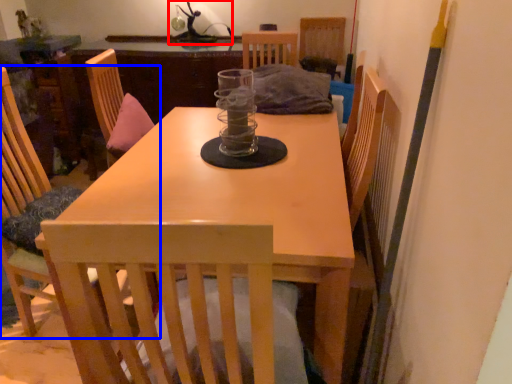
Question: Which object appears closest to the camera in this image, table lamp (highlighted by a red box) or chair (highlighted by a blue box)?

Choices:
 (A) table lamp
 (B) chair

Answer: (B)